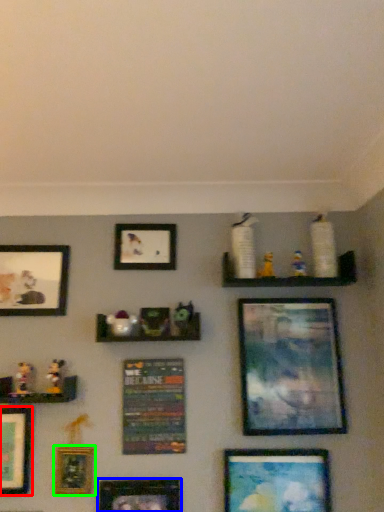
Question: Which is farther away from picture frame (highlighted by a red box)? picture frame (highlighted by a blue box) or picture frame (highlighted by a green box)?

Choices:
 (A) picture frame
 (B) picture frame

Answer: (A)